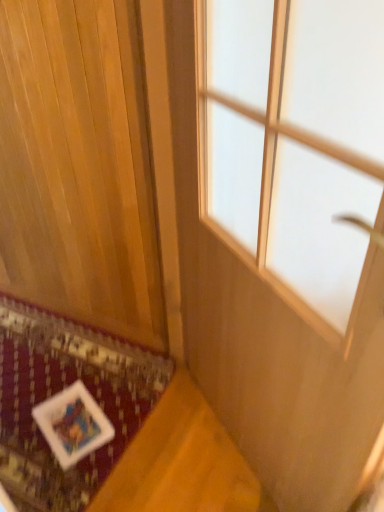
Question: Is wooden panel at lower left behind white fabric mat at lower left?

Choices:
 (A) no
 (B) yes

Answer: (A)

Question: Can you confirm if wooden panel at lower left is bigger than white fabric mat at lower left?

Choices:
 (A) yes
 (B) no

Answer: (A)

Question: Is wooden panel at lower left completely or partially outside of white fabric mat at lower left?

Choices:
 (A) no
 (B) yes

Answer: (B)

Question: Considering the relative positions of wooden panel at lower left and white fabric mat at lower left in the image provided, is wooden panel at lower left to the left of white fabric mat at lower left from the viewer's perspective?

Choices:
 (A) yes
 (B) no

Answer: (B)

Question: Does wooden panel at lower left appear on the right side of white fabric mat at lower left?

Choices:
 (A) yes
 (B) no

Answer: (A)

Question: Does point (82, 330) appear closer or farther from the camera than point (132, 81)?

Choices:
 (A) farther
 (B) closer

Answer: (A)

Question: From the image's perspective, is white fabric mat at lower left positioned above or below wooden panel at lower left?

Choices:
 (A) above
 (B) below

Answer: (B)

Question: In the image, is white fabric mat at lower left on the left side or the right side of wooden panel at lower left?

Choices:
 (A) right
 (B) left

Answer: (B)

Question: Is white fabric mat at lower left taller or shorter than wooden panel at lower left?

Choices:
 (A) short
 (B) tall

Answer: (A)

Question: Considering the positions of point (271, 87) and point (71, 376), is point (271, 87) closer or farther from the camera than point (71, 376)?

Choices:
 (A) farther
 (B) closer

Answer: (B)

Question: In the image, is transparent glass window at center positioned in front of or behind white fabric mat at lower left?

Choices:
 (A) front
 (B) behind

Answer: (A)

Question: Looking at the image, does transparent glass window at center seem bigger or smaller compared to white fabric mat at lower left?

Choices:
 (A) big
 (B) small

Answer: (A)

Question: From the image's perspective, is transparent glass window at center above or below white fabric mat at lower left?

Choices:
 (A) above
 (B) below

Answer: (A)

Question: Would you say wooden panel at lower left is inside or outside white fabric mat at lower left?

Choices:
 (A) outside
 (B) inside

Answer: (A)

Question: From a real-world perspective, is wooden panel at lower left positioned above or below white fabric mat at lower left?

Choices:
 (A) above
 (B) below

Answer: (A)